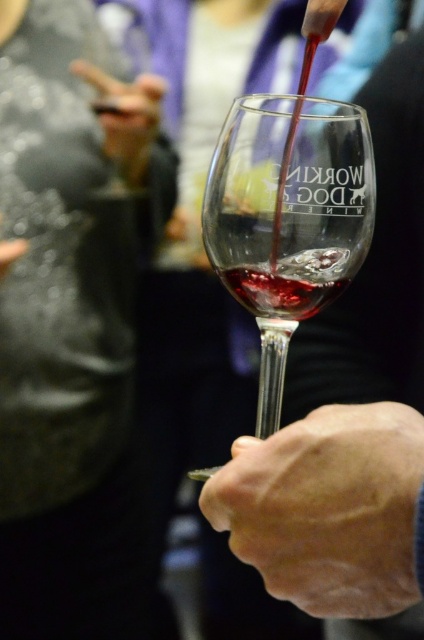
You are a photographer at a social event. You want to capture a photo of the black leather jacket at upper left and the smooth skin hand at center in the same frame. The camera you are using has a maximum focus range of 15 inches. Will both objects be in focus?

The distance between the black leather jacket at upper left and the smooth skin hand at center is 17.41 inches, which exceeds the camera maximum focus range of 15 inches. Therefore, both objects cannot be in focus simultaneously.

You are holding a smartphone with a 15 cm long screen. You want to take a photo of the translucent glass at center. Can your phone fit entirely within the frame if you position it so that the phone is parallel to the glass and aligned with its edges?

The distance between the translucent glass at center and the viewer is 32.60 centimeters. Since the phone is 15 cm long, and assuming the phone is positioned parallel and aligned with the glass, the phone can fit within the frame as the distance allows sufficient space for the phone to be captured in full.

You are standing in front of the wine glass being filled with red wine. There are two points marked in the image. Which point is closer to you, point [142,177] or point [278,266]?

Point [142,177] is closer to you because it is further to the viewer than point [278,266].